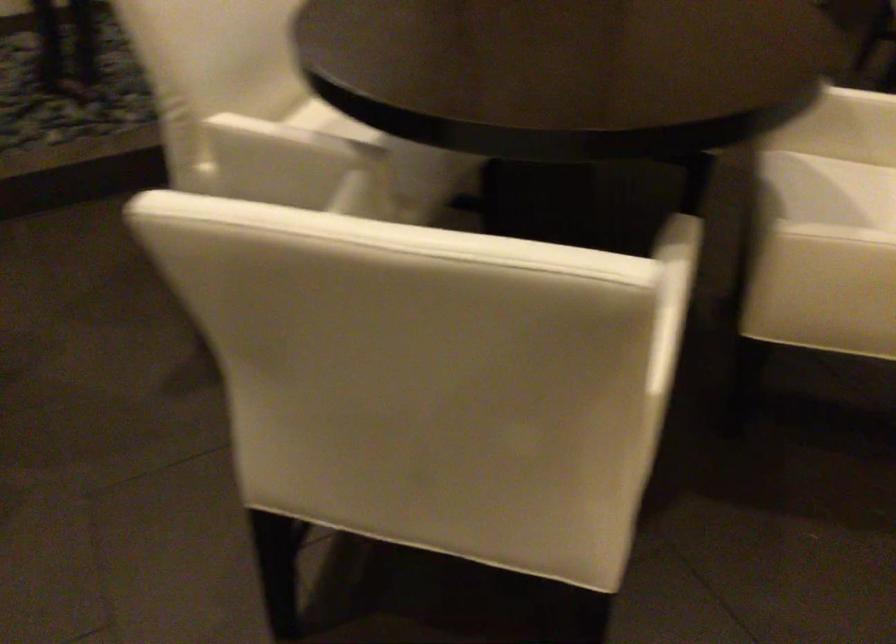
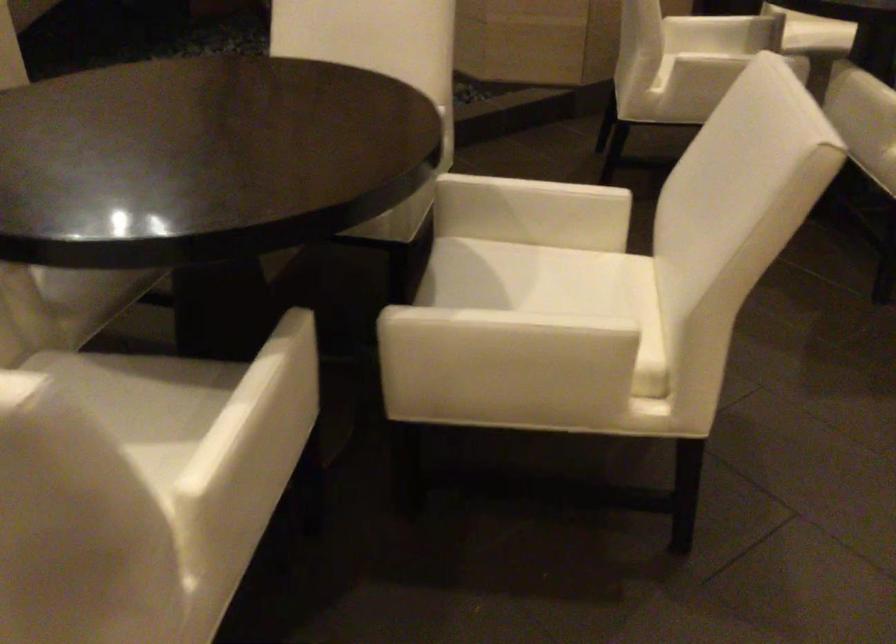
Question: How did the camera likely rotate?

Choices:
 (A) Left
 (B) Right
 (C) Up
 (D) Down

Answer: (B)